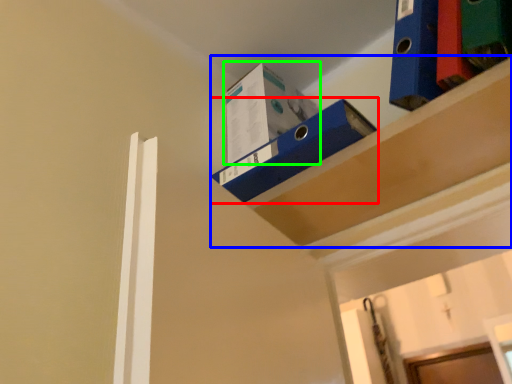
Question: Considering the real-world distances, which object is closest to shelf (highlighted by a red box)? shelf (highlighted by a blue box) or box (highlighted by a green box).

Choices:
 (A) shelf
 (B) box

Answer: (A)